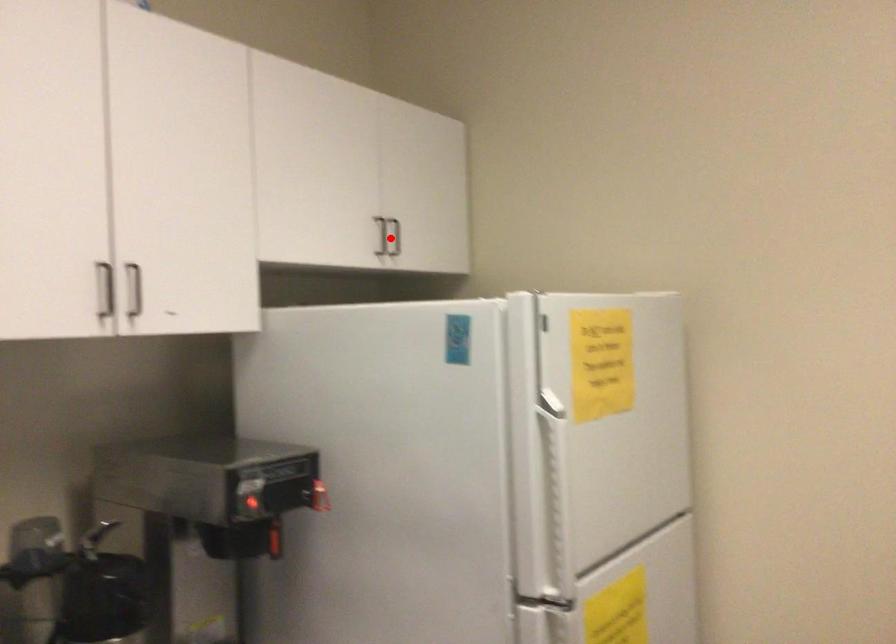
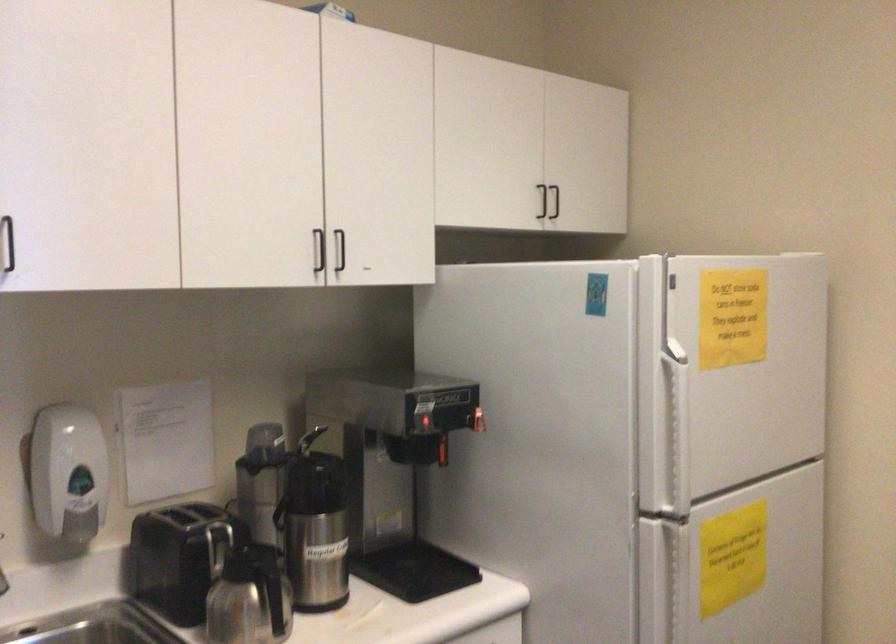
Question: I am providing you with two images of the same scene from different viewpoints. In image1, a red point is highlighted. Considering the same 3D point in image2, which of the following is correct?

Choices:
 (A) It is closer
 (B) It is farther

Answer: (B)